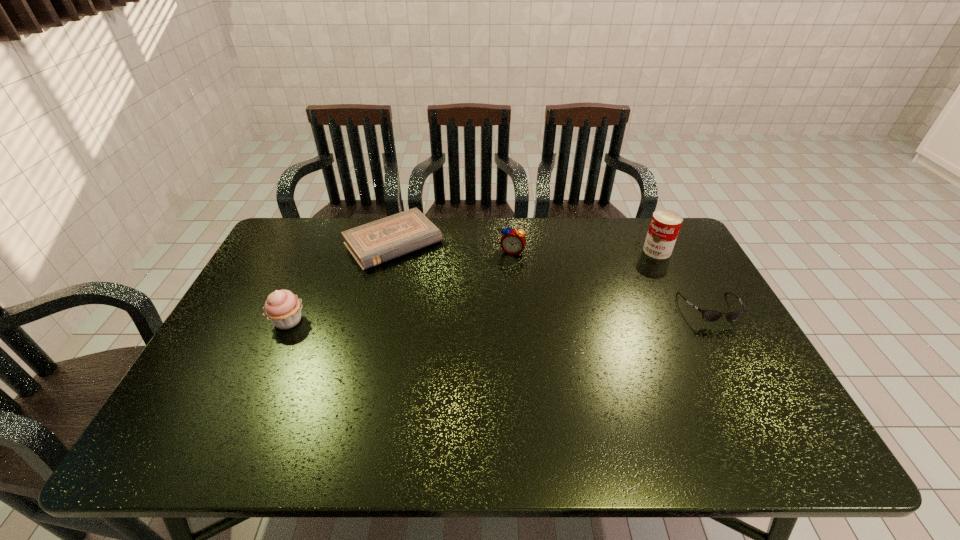
The image size is (960, 540). Identify the location of object that is the closest to the can. (708, 315).

Locate an element on the screen. This screenshot has height=540, width=960. free space that satisfies the following two spatial constraints: 1. on the back side of the leftmost object; 2. on the left side of the third object from left to right is located at coordinates (320, 251).

Identify the location of free space that satisfies the following two spatial constraints: 1. on the back side of the can; 2. on the right side of the alarm clock. The image size is (960, 540). (513, 251).